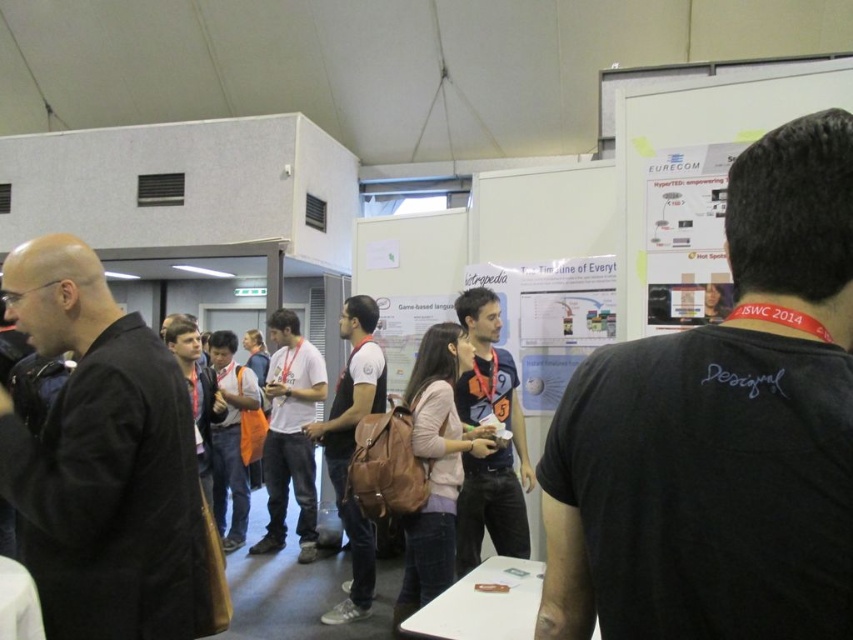
You are a photographer at the event and want to take a photo of the brown leather backpack at center without including the black fabric jacket at left in the frame. Is this possible based on their positions?

The black fabric jacket at left is located above the brown leather backpack at center, so if you position your camera to focus on the backpack below, you can avoid including the jacket in the shot.